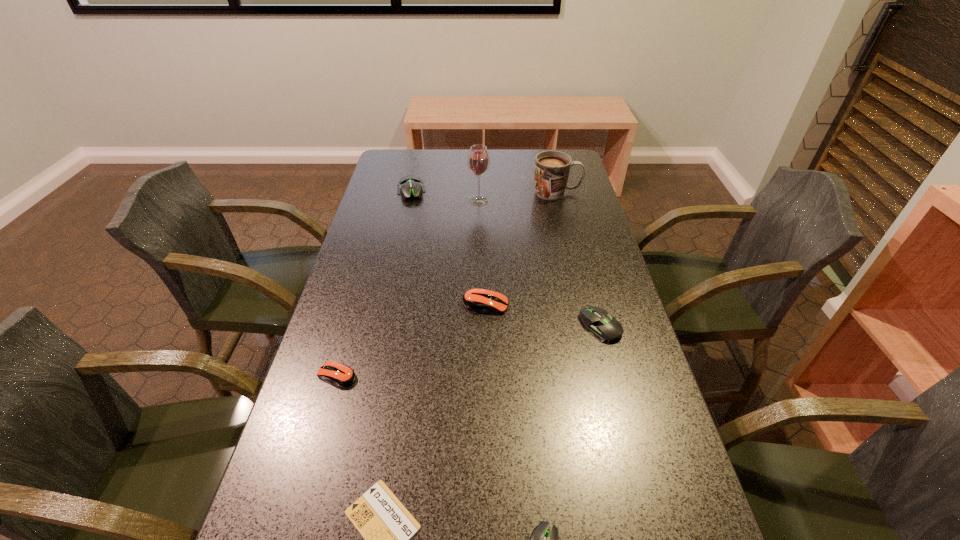
At what (x,y) coordinates should I click in order to perform the action: click on the tallest object. Please return your answer as a coordinate pair (x, y). Looking at the image, I should click on (478, 161).

The width and height of the screenshot is (960, 540). I want to click on wineglass, so click(478, 161).

Image resolution: width=960 pixels, height=540 pixels. I want to click on the second tallest object, so click(x=552, y=168).

You are a GUI agent. You are given a task and a screenshot of the screen. Output one action in this format:
    pyautogui.click(x=<x>, y=<y>)
    Task: Click on the leftmost gray computer mouse
    This screenshot has width=960, height=540.
    Given the screenshot: What is the action you would take?
    pyautogui.click(x=409, y=185)

Identify the location of the biggest gray computer mouse. (409, 185).

You are a GUI agent. You are given a task and a screenshot of the screen. Output one action in this format:
    pyautogui.click(x=<x>, y=<y>)
    Task: Click on the bigger orange computer mouse
    The width and height of the screenshot is (960, 540).
    Given the screenshot: What is the action you would take?
    pyautogui.click(x=484, y=300)

Where is `the farther orange computer mouse`? Image resolution: width=960 pixels, height=540 pixels. the farther orange computer mouse is located at coordinates (484, 300).

I want to click on the second nearest gray computer mouse, so 603,327.

Where is `the rightmost computer mouse`? Image resolution: width=960 pixels, height=540 pixels. the rightmost computer mouse is located at coordinates (603, 327).

Identify the location of the sixth farthest object. This screenshot has height=540, width=960. pyautogui.click(x=341, y=375).